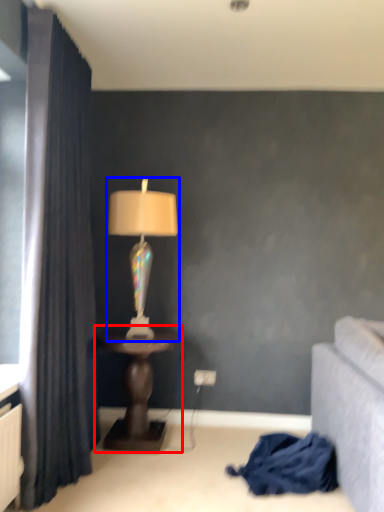
Question: Among these objects, which one is farthest to the camera, table (highlighted by a red box) or lamp (highlighted by a blue box)?

Choices:
 (A) table
 (B) lamp

Answer: (B)